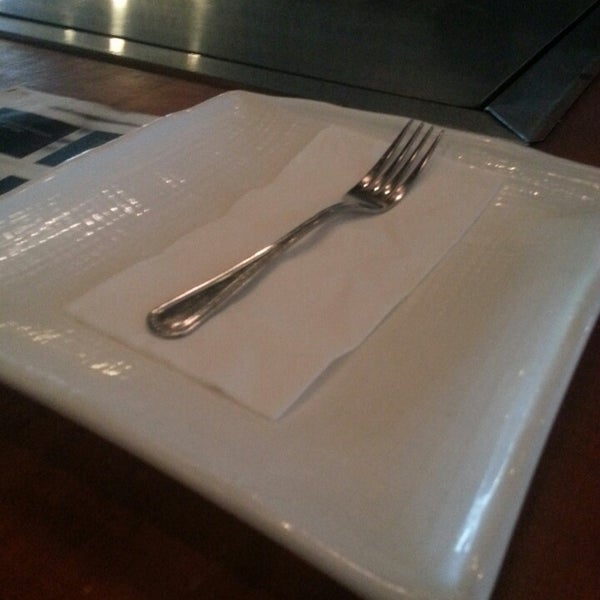
The image size is (600, 600). I want to click on napkin under fork, so click(274, 302).